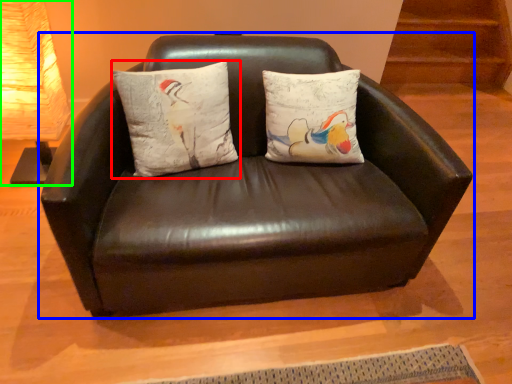
Question: Which object is the closest to the pillow (highlighted by a red box)? Choose among these: studio couch (highlighted by a blue box) or table lamp (highlighted by a green box).

Choices:
 (A) studio couch
 (B) table lamp

Answer: (A)